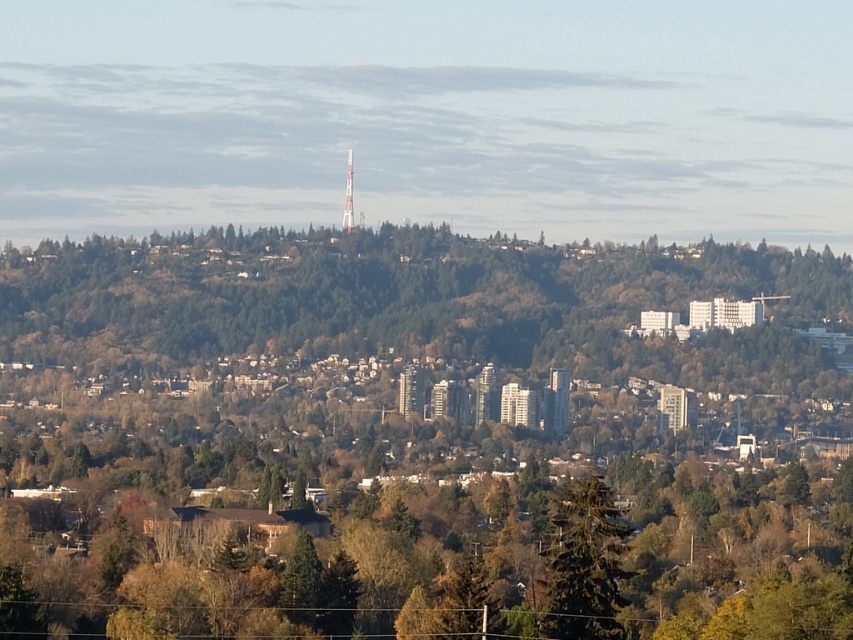
Looking at this image, you are a drone operator who needs to fly a drone from your current position to the red and white communication tower atop the hill. The drone has a maximum flight range of 600 meters. There is a green matte tree at center in your way. Can you safely fly your drone to the tower without exceeding its range?

The green matte tree at center is 646.93 meters from viewer, which exceeds the drone maximum flight range of 600 meters. Therefore, the drone cannot reach the tower without exceeding its range.

You are a drone operator planning to fly a drone from the green textured tree at center to the silver metallic tv tower at center. Based on the scene description, will the drone have an unobstructed path to the tower?

The green textured tree at center is positioned under the silver metallic tv tower at center, so the drone will have an unobstructed path to the tower since the tree is directly below it and there are no other obstacles mentioned in the scene description.